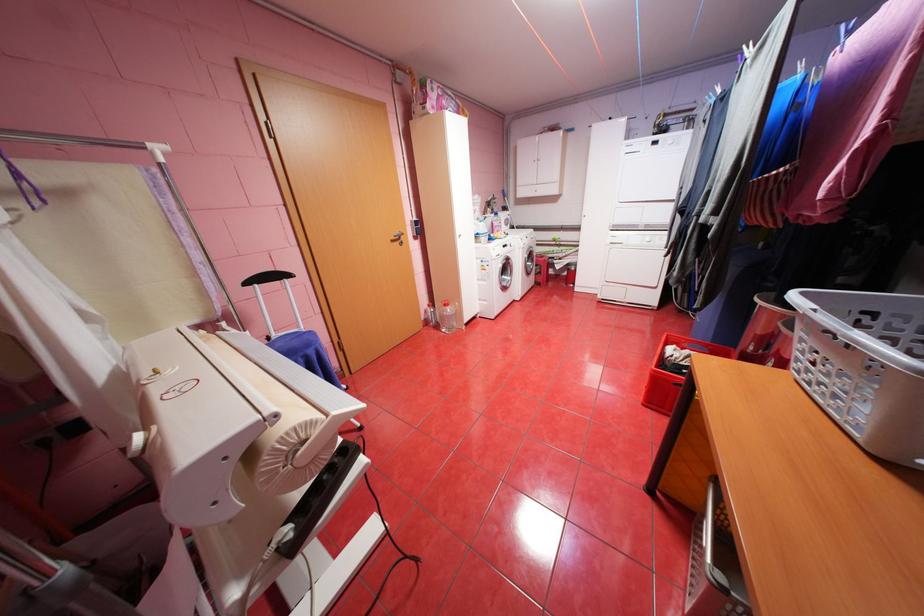
The width and height of the screenshot is (924, 616). Identify the location of silver door handle. (397, 238).